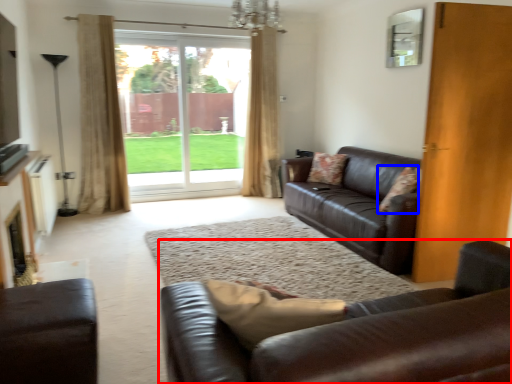
Question: Among these objects, which one is nearest to the camera, studio couch (highlighted by a red box) or pillow (highlighted by a blue box)?

Choices:
 (A) studio couch
 (B) pillow

Answer: (A)